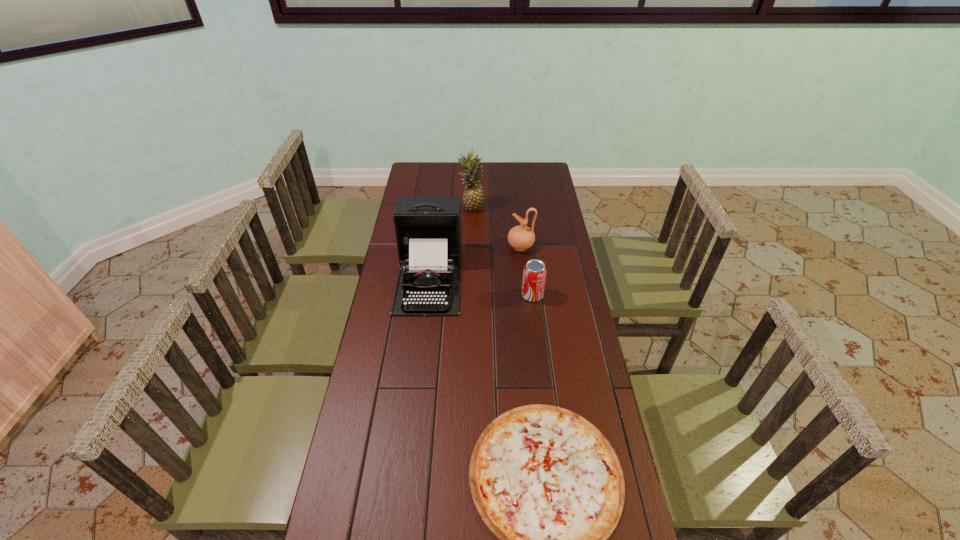
You are a GUI agent. You are given a task and a screenshot of the screen. Output one action in this format:
    pyautogui.click(x=<x>, y=<y>)
    Task: Click on the pineapple
    This screenshot has height=540, width=960.
    Given the screenshot: What is the action you would take?
    pyautogui.click(x=473, y=197)

The height and width of the screenshot is (540, 960). Find the location of `typewriter`. typewriter is located at coordinates (428, 229).

Where is `the third tallest object`? Image resolution: width=960 pixels, height=540 pixels. the third tallest object is located at coordinates (521, 238).

Image resolution: width=960 pixels, height=540 pixels. Identify the location of soda can. (534, 274).

This screenshot has height=540, width=960. Identify the location of free space located 0.060m on the back of the farthest object. (472, 194).

At what (x,y) coordinates should I click in order to perform the action: click on vacant space situated inside the open case of the typewriter. Please return your answer as a coordinate pair (x, y). This screenshot has width=960, height=540. Looking at the image, I should click on (417, 382).

Identify the location of vacant space located on the spout of the third shortest object. Image resolution: width=960 pixels, height=540 pixels. (420, 247).

Locate an element on the screen. free spot located 0.080m on the spout of the third shortest object is located at coordinates (489, 247).

This screenshot has height=540, width=960. Identify the location of vacant space situated 0.150m on the spout of the third shortest object. (471, 247).

Locate an element on the screen. This screenshot has height=540, width=960. free space located 0.330m on the back of the soda can is located at coordinates (525, 235).